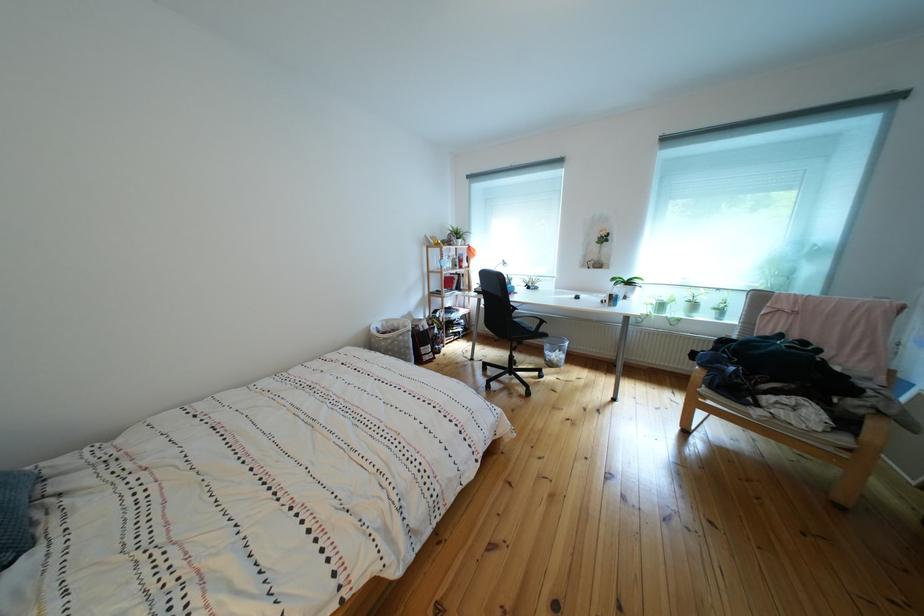
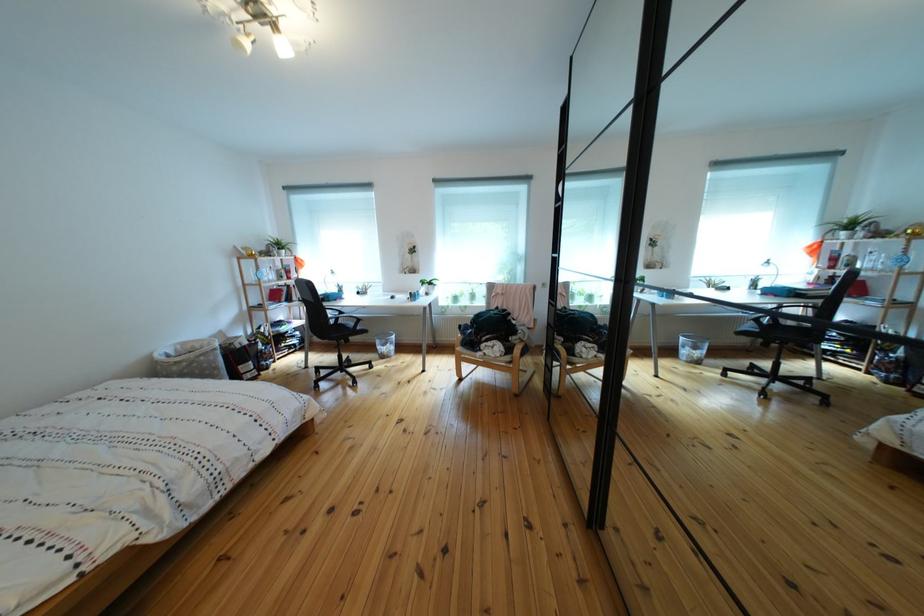
In the second image, find the point that corresponds to point (458, 275) in the first image.

(282, 286)